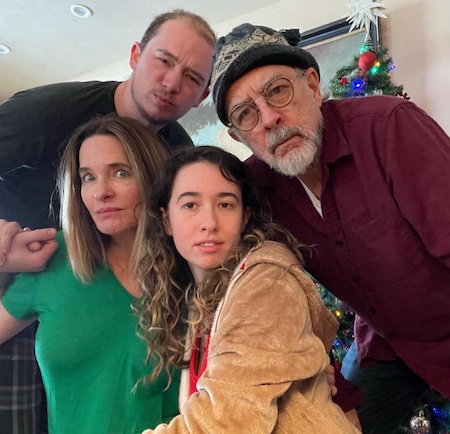
This screenshot has width=450, height=434. What are the coordinates of `family photo` in the screenshot? It's located at (68, 286).